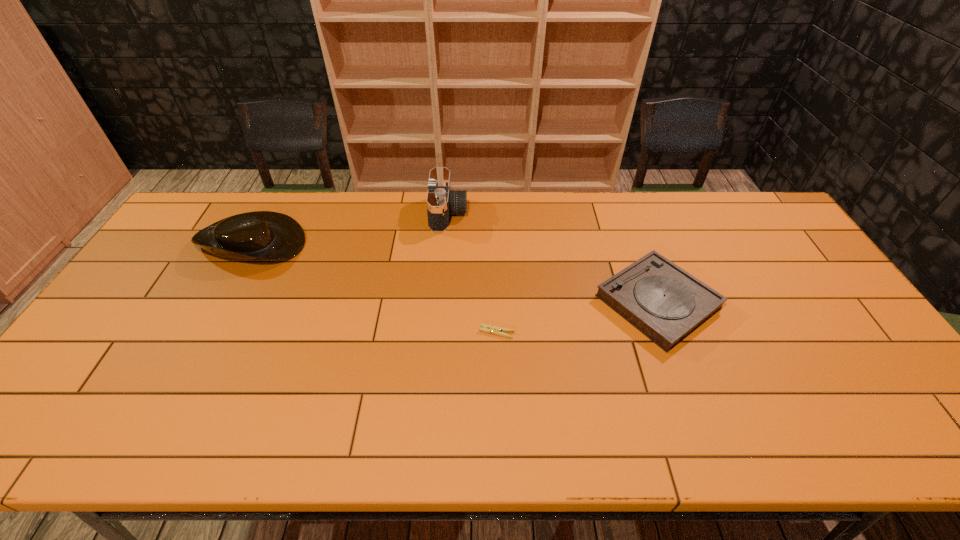
You are a GUI agent. You are given a task and a screenshot of the screen. Output one action in this format:
    pyautogui.click(x=<x>, y=<y>)
    Task: Click on the camera
    The width and height of the screenshot is (960, 540).
    Given the screenshot: What is the action you would take?
    pyautogui.click(x=441, y=201)

What are the coordinates of `the tallest object` in the screenshot? It's located at (441, 201).

Find the location of a particular element. The width and height of the screenshot is (960, 540). cowboy hat is located at coordinates (269, 235).

I want to click on the third shortest object, so click(x=269, y=235).

Locate an element on the screen. This screenshot has width=960, height=540. the third tallest object is located at coordinates (664, 302).

At what (x,y) coordinates should I click in order to perform the action: click on the rightmost object. Please return your answer as a coordinate pair (x, y). The image size is (960, 540). Looking at the image, I should click on [664, 302].

Find the location of a particular element. clothespin is located at coordinates (486, 328).

At what (x,y) coordinates should I click in order to perform the action: click on the second object from right to left. Please return your answer as a coordinate pair (x, y). The width and height of the screenshot is (960, 540). Looking at the image, I should click on (486, 328).

At what (x,y) coordinates should I click in order to perform the action: click on vacant space located 0.140m on the front-facing side of the camera. Please return your answer as a coordinate pair (x, y). Looking at the image, I should click on (508, 214).

At what (x,y) coordinates should I click in order to perform the action: click on free region located 0.200m on the right of the cowboy hat. Please return your answer as a coordinate pair (x, y). The image size is (960, 540). Looking at the image, I should click on (369, 240).